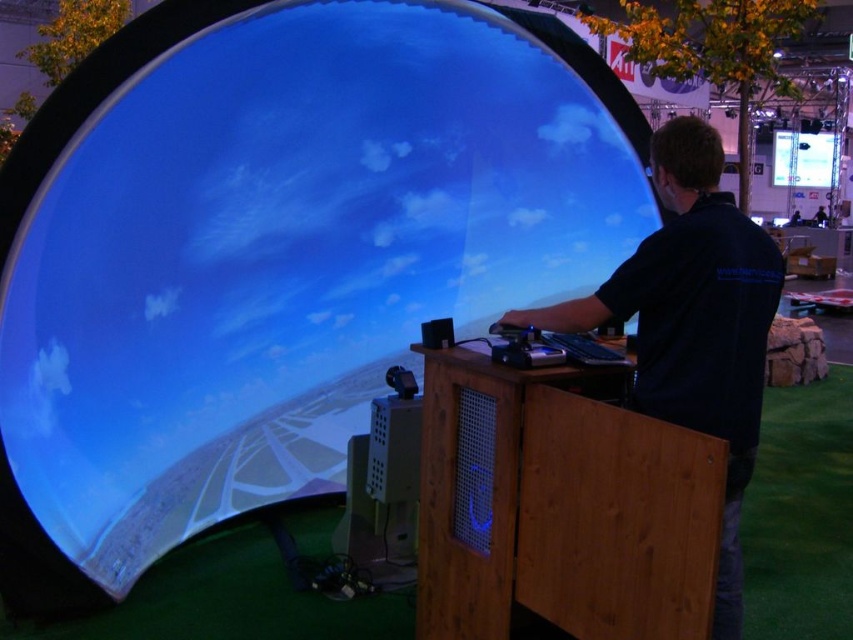
Question: Which point appears farthest from the camera in this image?

Choices:
 (A) (621, 470)
 (B) (675, 202)

Answer: (B)

Question: Observing the image, what is the correct spatial positioning of wooden table at center in reference to dark blue shirt at center?

Choices:
 (A) right
 (B) left

Answer: (B)

Question: Does wooden table at center appear over dark blue shirt at center?

Choices:
 (A) no
 (B) yes

Answer: (A)

Question: Does wooden table at center have a greater width compared to dark blue shirt at center?

Choices:
 (A) no
 (B) yes

Answer: (A)